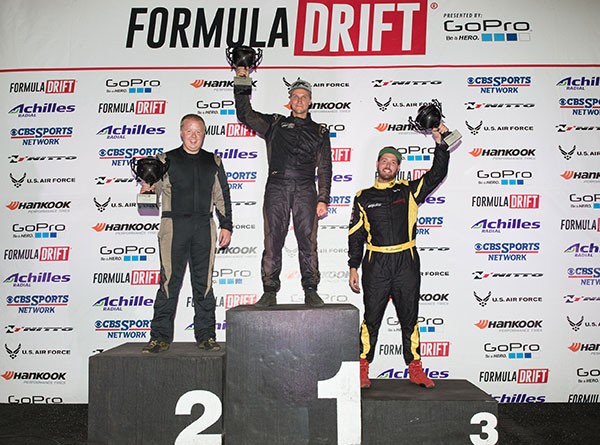
Image resolution: width=600 pixels, height=445 pixels. Find the location of `trophies`. trophies is located at coordinates (238, 55), (145, 170), (433, 113).